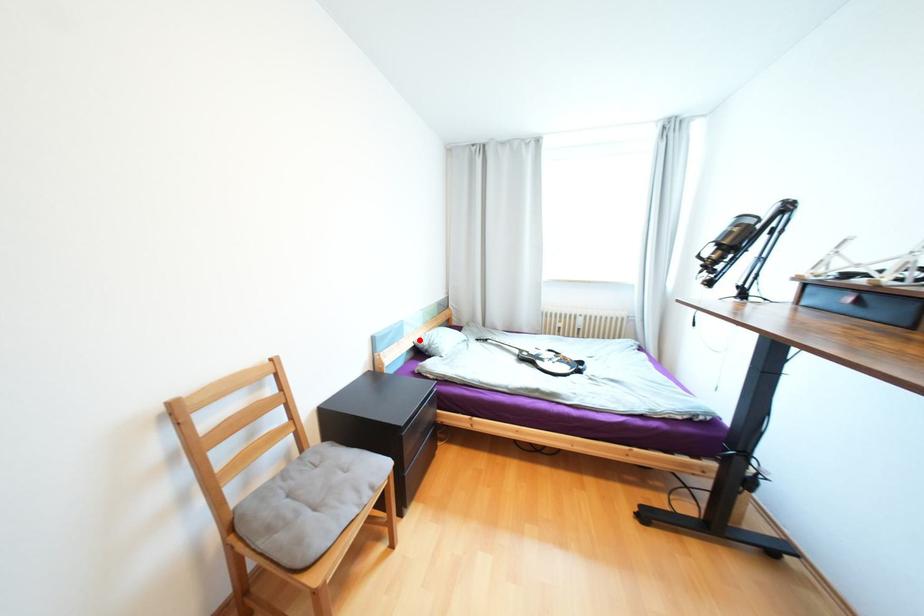
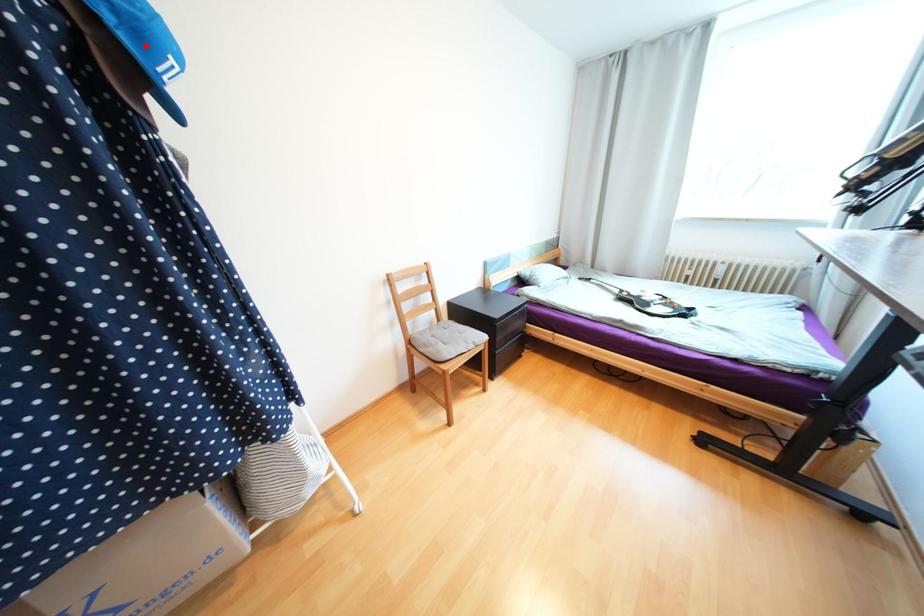
I am providing you with two images of the same scene from different viewpoints. A red point is marked on the first image and another point is marked on the second image. Is the red point in image1 aligned with the point shown in image2?

No